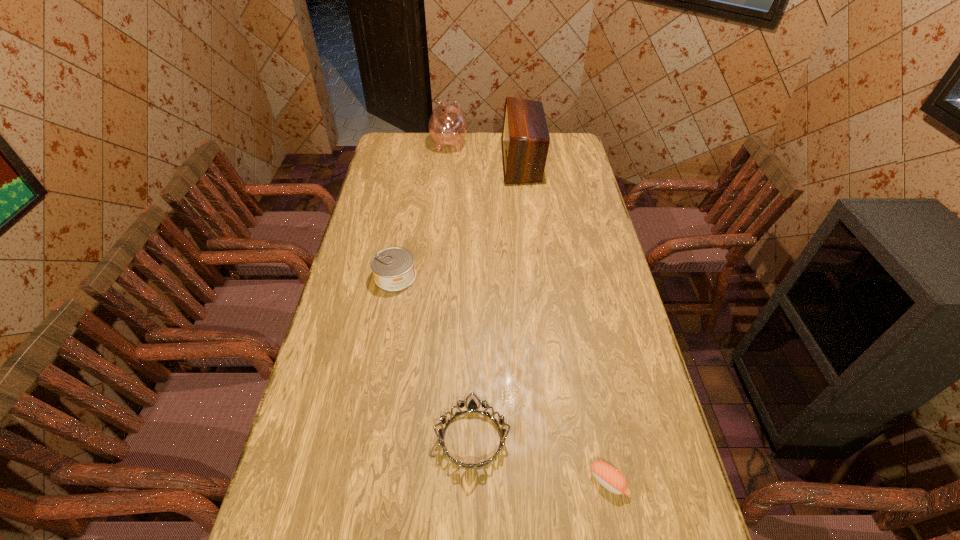
The width and height of the screenshot is (960, 540). I want to click on the third closest object to the tallest object, so click(472, 406).

The height and width of the screenshot is (540, 960). I want to click on free space in the image that satisfies the following two spatial constraints: 1. on the front-facing side of the tiara; 2. on the back side of the shortest object, so click(x=471, y=482).

In order to click on vacant point that satisfies the following two spatial constraints: 1. on the back side of the shortest object; 2. on the front-facing side of the fourth tallest object in this screenshot , I will do `click(600, 438)`.

Identify the location of blank space that satisfies the following two spatial constraints: 1. on the front-facing side of the radio receiver; 2. on the front side of the third nearest object. (536, 276).